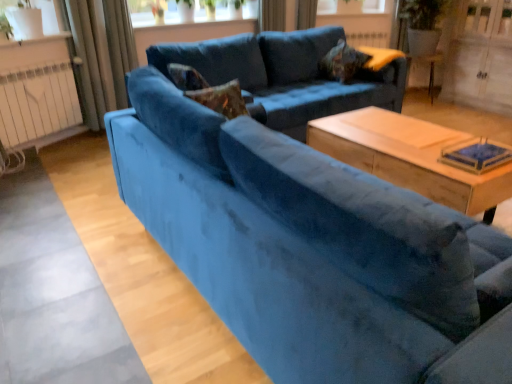
Where is `vacant space in white matte radiator at left (from a real-world perspective)`? This screenshot has width=512, height=384. vacant space in white matte radiator at left (from a real-world perspective) is located at coordinates (61, 148).